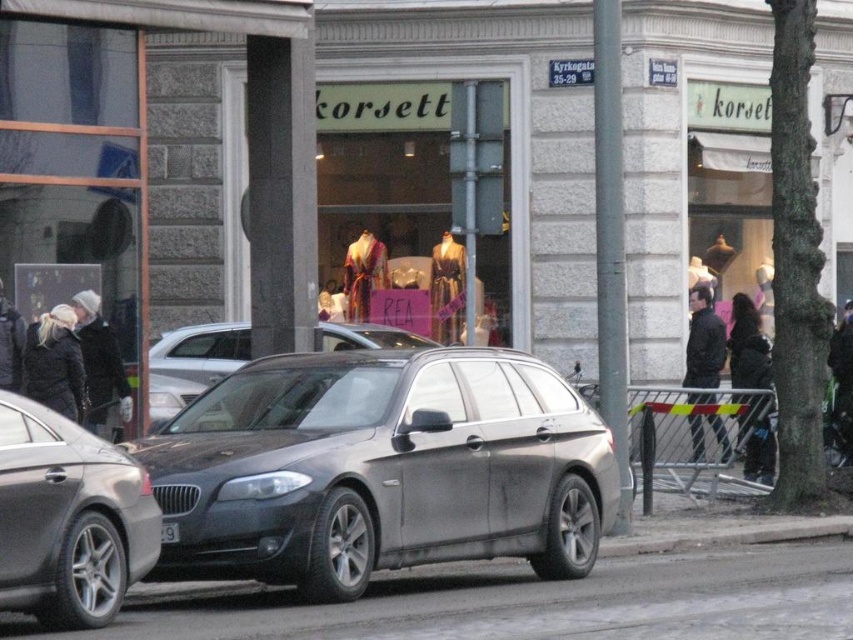
From the picture: You are standing on the sidewalk in front of the korsett clothing store. You see a dark gray metallic car at center and a satin silver car at center. Which car is positioned to the right of the other?

The dark gray metallic car at center is to the right of the satin silver car at center.

You are a delivery person with a package that requires a 1.5 meter space to place the wagon. You see the satin silver wagon at center and the dark gray metallic car at center. Is there enough space between them to place your wagon?

The satin silver wagon at center is 1.45 meters from the dark gray metallic car at center, which is slightly less than the required 1.5 meters. Therefore, there isn not enough space to place the wagon between them.